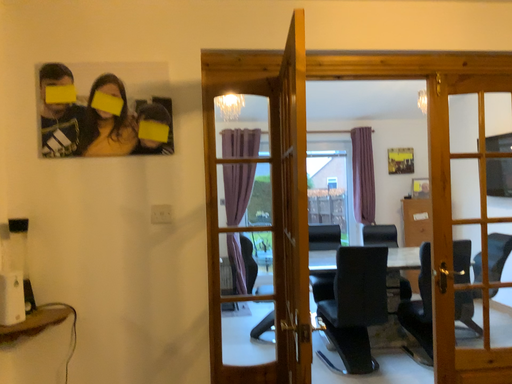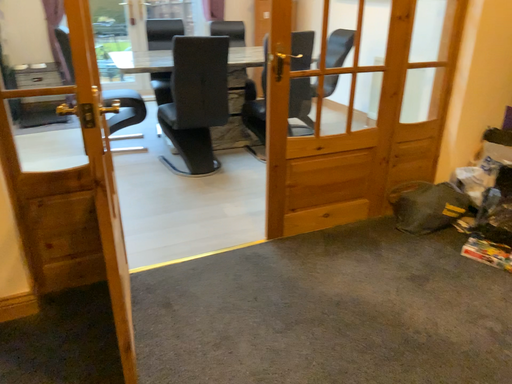
Question: How did the camera likely rotate when shooting the video?

Choices:
 (A) rotated downward
 (B) rotated upward

Answer: (A)